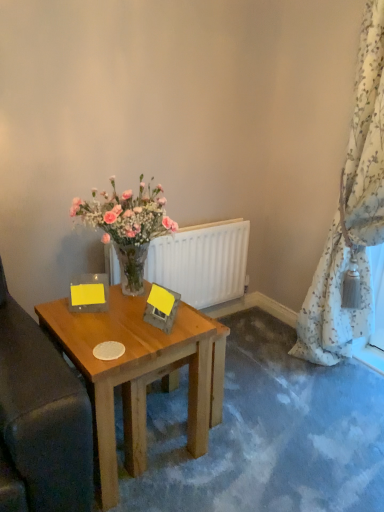
Question: Would you consider floral-patterned fabric at right to be distant from white matte radiator at center?

Choices:
 (A) no
 (B) yes

Answer: (A)

Question: Is floral-patterned fabric at right to the left of white matte radiator at center from the viewer's perspective?

Choices:
 (A) no
 (B) yes

Answer: (A)

Question: Is floral-patterned fabric at right shorter than white matte radiator at center?

Choices:
 (A) no
 (B) yes

Answer: (A)

Question: From a real-world perspective, is floral-patterned fabric at right positioned under white matte radiator at center based on gravity?

Choices:
 (A) no
 (B) yes

Answer: (A)

Question: Considering the relative sizes of floral-patterned fabric at right and white matte radiator at center in the image provided, is floral-patterned fabric at right smaller than white matte radiator at center?

Choices:
 (A) yes
 (B) no

Answer: (B)

Question: Considering the relative sizes of floral-patterned fabric at right and white matte radiator at center in the image provided, is floral-patterned fabric at right bigger than white matte radiator at center?

Choices:
 (A) yes
 (B) no

Answer: (A)

Question: Is wooden table at center taller than floral-patterned fabric at right?

Choices:
 (A) yes
 (B) no

Answer: (B)

Question: Is wooden table at center wider than floral-patterned fabric at right?

Choices:
 (A) yes
 (B) no

Answer: (A)

Question: From a real-world perspective, is wooden table at center positioned over floral-patterned fabric at right based on gravity?

Choices:
 (A) yes
 (B) no

Answer: (B)

Question: From the image's perspective, is wooden table at center below floral-patterned fabric at right?

Choices:
 (A) no
 (B) yes

Answer: (B)

Question: From a real-world perspective, is wooden table at center located beneath floral-patterned fabric at right?

Choices:
 (A) yes
 (B) no

Answer: (A)

Question: Is wooden table at center further to camera compared to floral-patterned fabric at right?

Choices:
 (A) no
 (B) yes

Answer: (A)

Question: Does white matte radiator at center have a larger size compared to floral-patterned fabric at right?

Choices:
 (A) yes
 (B) no

Answer: (B)